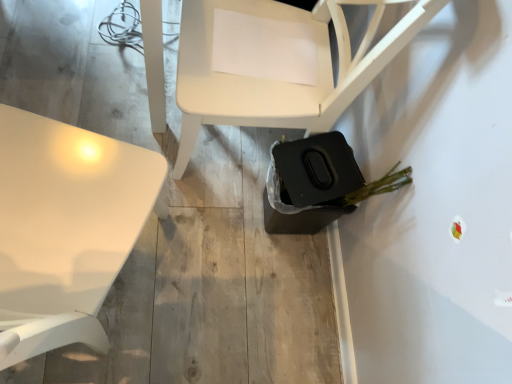
The width and height of the screenshot is (512, 384). Describe the element at coordinates (278, 82) in the screenshot. I see `matte white chair at center` at that location.

At what (x,y) coordinates should I click in order to perform the action: click on matte white chair at center. Please return your answer as a coordinate pair (x, y). This screenshot has width=512, height=384. Looking at the image, I should click on (278, 82).

What do you see at coordinates (65, 229) in the screenshot? I see `white glossy table at upper left` at bounding box center [65, 229].

Locate an element on the screen. Image resolution: width=512 pixels, height=384 pixels. white glossy table at upper left is located at coordinates (65, 229).

The width and height of the screenshot is (512, 384). What are the coordinates of `matte white chair at center` in the screenshot? It's located at (278, 82).

Is matte white chair at center at the left side of white glossy table at upper left?

In fact, matte white chair at center is to the right of white glossy table at upper left.

Which object is closer to the camera taking this photo, matte white chair at center or white glossy table at upper left?

white glossy table at upper left is closer to the camera.

Which is further, (305, 89) or (106, 168)?

Positioned behind is point (305, 89).

From the image's perspective, between matte white chair at center and white glossy table at upper left, which one is located above?

matte white chair at center is shown above in the image.

From a real-world perspective, which object stands above the other?

white glossy table at upper left is physically above.

Can you confirm if matte white chair at center is thinner than white glossy table at upper left?

Indeed, matte white chair at center has a lesser width compared to white glossy table at upper left.

Between matte white chair at center and white glossy table at upper left, which one has less height?

Standing shorter between the two is matte white chair at center.

Between matte white chair at center and white glossy table at upper left, which one has smaller size?

matte white chair at center is smaller.

Is matte white chair at center situated inside white glossy table at upper left or outside?

matte white chair at center exists outside the volume of white glossy table at upper left.

Is matte white chair at center not near white glossy table at upper left?

matte white chair at center is actually quite close to white glossy table at upper left.

Is matte white chair at center positioned with its back to white glossy table at upper left?

No, matte white chair at center is not facing the opposite direction of white glossy table at upper left.

Find the location of a particular element. The image size is (512, 384). chair that is behind the white glossy table at upper left is located at coordinates (278, 82).

Which is more to the right, white glossy table at upper left or matte white chair at center?

From the viewer's perspective, matte white chair at center appears more on the right side.

Consider the image. Which is behind, white glossy table at upper left or matte white chair at center?

matte white chair at center is more distant.

Considering the points (4, 327) and (319, 128), which point is behind, point (4, 327) or point (319, 128)?

Point (319, 128)

From the image's perspective, between white glossy table at upper left and matte white chair at center, which one is located above?

matte white chair at center, from the image's perspective.

From a real-world perspective, is white glossy table at upper left over matte white chair at center?

Correct, in the physical world, white glossy table at upper left is higher than matte white chair at center.

Between white glossy table at upper left and matte white chair at center, which one has smaller width?

matte white chair at center is thinner.

Considering the relative sizes of white glossy table at upper left and matte white chair at center in the image provided, is white glossy table at upper left taller than matte white chair at center?

Indeed, white glossy table at upper left has a greater height compared to matte white chair at center.

Between white glossy table at upper left and matte white chair at center, which one has smaller size?

matte white chair at center.

Can we say white glossy table at upper left lies outside matte white chair at center?

white glossy table at upper left lies outside matte white chair at center's area.

Would you say white glossy table at upper left is a long distance from matte white chair at center?

No, white glossy table at upper left is not far away from matte white chair at center.

Is white glossy table at upper left turned away from matte white chair at center?

No, white glossy table at upper left is not facing away from matte white chair at center.

What are the coordinates of `table on the left of matte white chair at center` in the screenshot? It's located at pyautogui.click(x=65, y=229).

Find the location of `chair on the right of white glossy table at upper left`. chair on the right of white glossy table at upper left is located at coordinates (278, 82).

At what (x,y) coordinates should I click in order to perform the action: click on chair above the white glossy table at upper left (from the image's perspective). Please return your answer as a coordinate pair (x, y). The width and height of the screenshot is (512, 384). Looking at the image, I should click on (278, 82).